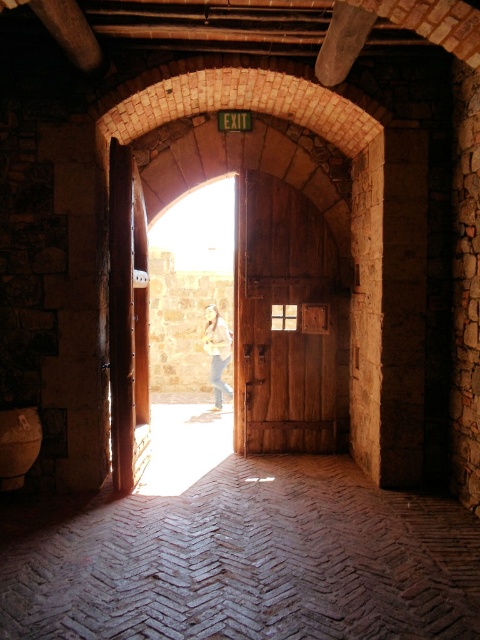
You are standing in the stone structure and want to hang your light brown leather jacket at center on the wooden door at center. Can you fit the jacket on the door?

The wooden door at center is larger in size than the light brown leather jacket at center, so yes, the jacket can be hung on the door.

You are a visitor entering the stone structure and see the wooden door at center and the light brown leather jacket at center. Which object is taller?

The wooden door at center is taller than the light brown leather jacket at center.